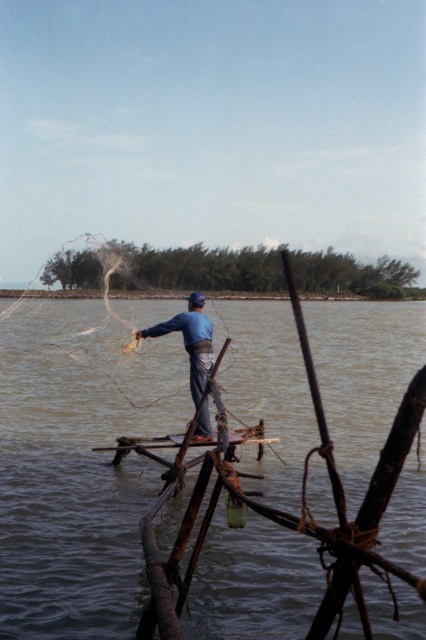
Who is more distant from viewer, (49, 460) or (201, 424)?

Point (49, 460)

Is brown muddy water at center above blue fabric fisherman at center?

Yes.

Which is behind, point (221, 588) or point (195, 387)?

The point (195, 387) is behind.

You are a GUI agent. You are given a task and a screenshot of the screen. Output one action in this format:
    pyautogui.click(x=<x>, y=<y>)
    Task: Click on the brown muddy water at center
    This screenshot has height=640, width=426.
    Given the screenshot: What is the action you would take?
    (x=75, y=472)